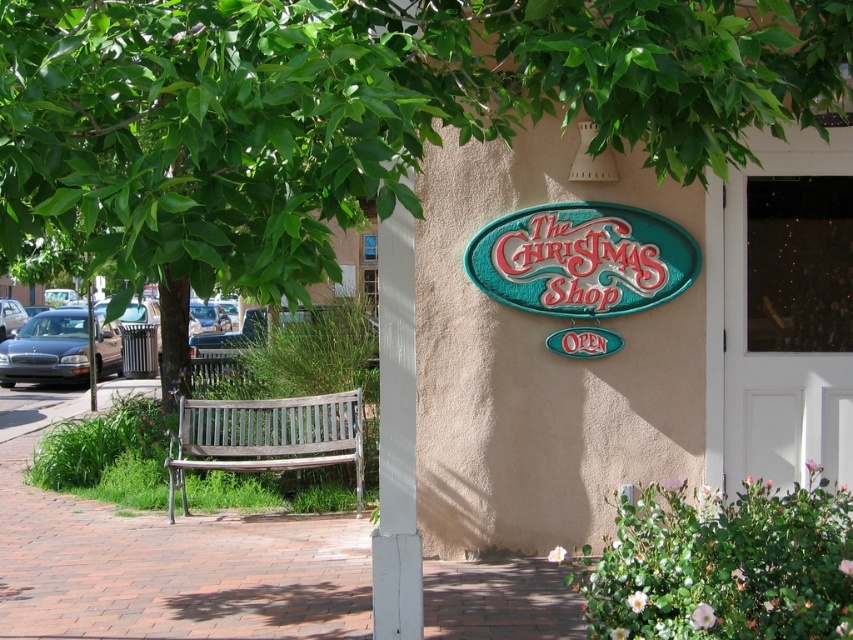
You are a customer approaching The Christmas Shop and see the green leafy tree at upper left and the teal glossy sign at center. Which object is located to the left of the other?

The green leafy tree at upper left is positioned on the left side of teal glossy sign at center.